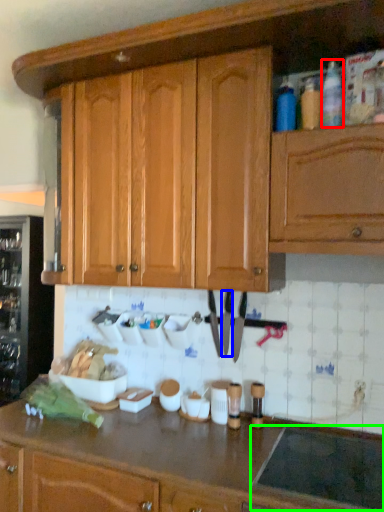
Question: Based on their relative distances, which object is nearer to bottle (highlighted by a red box)? Choose from knife (highlighted by a blue box) and appliance (highlighted by a green box).

Choices:
 (A) knife
 (B) appliance

Answer: (A)